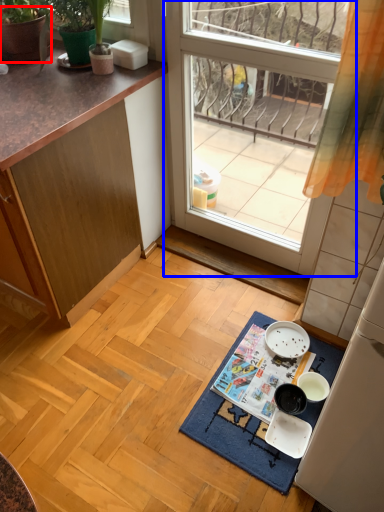
Question: Which object is further to the camera taking this photo, flowerpot (highlighted by a red box) or window (highlighted by a blue box)?

Choices:
 (A) flowerpot
 (B) window

Answer: (A)